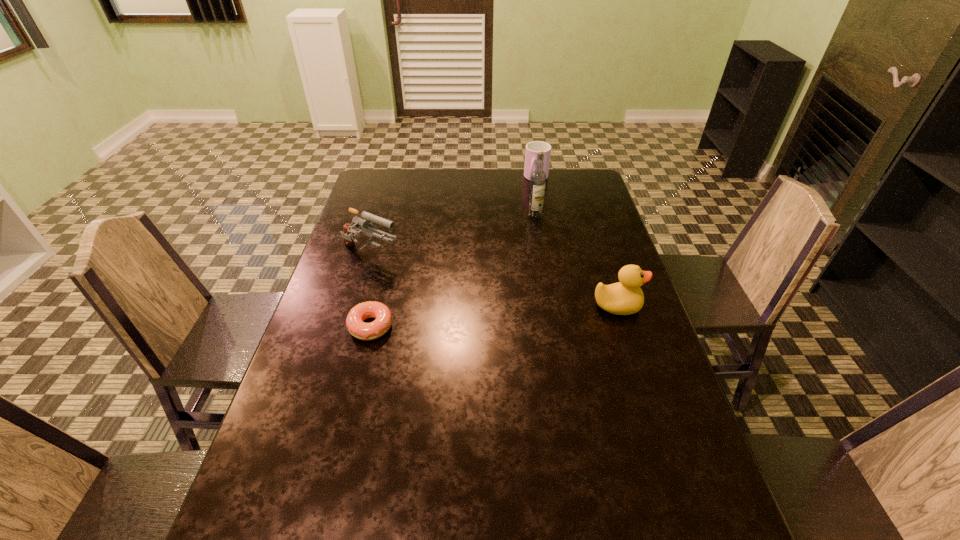
Find the location of `free space between the duck and the second farthest object`. free space between the duck and the second farthest object is located at coordinates (576, 260).

The height and width of the screenshot is (540, 960). I want to click on vacant space that's between the duck and the third nearest object, so click(x=493, y=281).

Locate an element on the screen. free space between the shortest object and the rightmost object is located at coordinates [x=493, y=316].

Where is `object that is the second closest to the rightmost object`? This screenshot has height=540, width=960. object that is the second closest to the rightmost object is located at coordinates (364, 331).

Choose which object is the fourth nearest neighbor to the third nearest object. Please provide its 2D coordinates. Your answer should be formatted as a tuple, i.e. [(x, y)], where the tuple contains the x and y coordinates of a point satisfying the conditions above.

[(625, 297)]

Locate an element on the screen. This screenshot has width=960, height=540. free point that satisfies the following two spatial constraints: 1. on the back side of the second farthest object; 2. on the left side of the farthest object is located at coordinates (529, 178).

Locate an element on the screen. This screenshot has width=960, height=540. free space that satisfies the following two spatial constraints: 1. on the back side of the third nearest object; 2. on the left side of the fourth nearest object is located at coordinates (383, 214).

Locate an element on the screen. free space that satisfies the following two spatial constraints: 1. on the front side of the rightmost object; 2. at the beak of the gun is located at coordinates (356, 306).